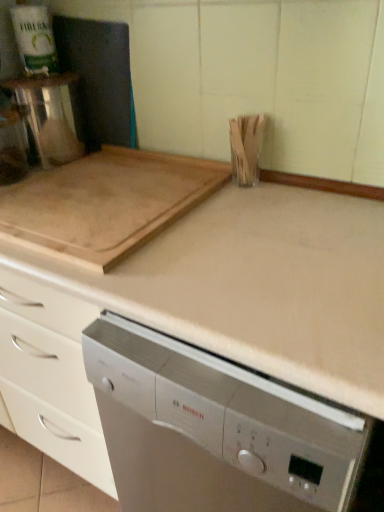
What are the coordinates of `free space in front of natural wood cutting board at upper left` in the screenshot? It's located at (193, 288).